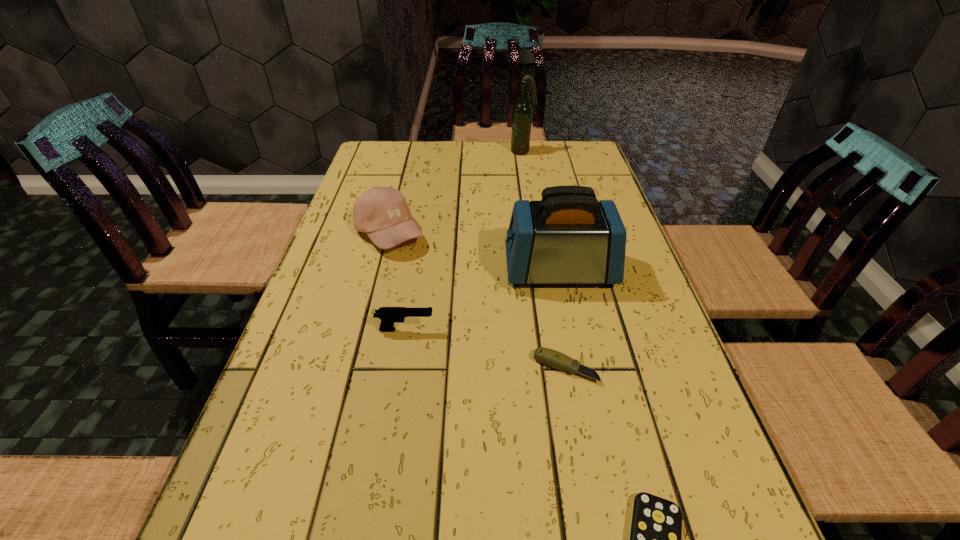
Image resolution: width=960 pixels, height=540 pixels. What are the coordinates of `vacant point located between the toaster and the third nearest object` in the screenshot? It's located at (482, 300).

Where is `blank region between the third shortest object and the farthest object`? blank region between the third shortest object and the farthest object is located at coordinates (464, 241).

At what (x,y) coordinates should I click in order to perform the action: click on unoccupied position between the baseball cap and the second nearest object. Please return your answer as a coordinate pair (x, y). The height and width of the screenshot is (540, 960). Looking at the image, I should click on (477, 301).

The height and width of the screenshot is (540, 960). I want to click on vacant point located between the third shortest object and the fifth shortest object, so click(482, 300).

Locate an element on the screen. This screenshot has width=960, height=540. object that is the closest to the farthest object is located at coordinates (382, 213).

Choose which object is the fifth nearest neighbor to the second tallest object. Please provide its 2D coordinates. Your answer should be formatted as a tuple, i.e. [(x, y)], where the tuple contains the x and y coordinates of a point satisfying the conditions above.

[(522, 111)]

At what (x,y) coordinates should I click in order to perform the action: click on free space in the image that satisfies the following two spatial constraints: 1. on the front side of the beer bottle; 2. on the front-facing side of the third shortest object. Please return your answer as a coordinate pair (x, y). The width and height of the screenshot is (960, 540). Looking at the image, I should click on (551, 330).

The image size is (960, 540). Identify the location of free space that satisfies the following two spatial constraints: 1. on the front-facing side of the fourth tallest object; 2. on the left side of the fifth farthest object. (399, 368).